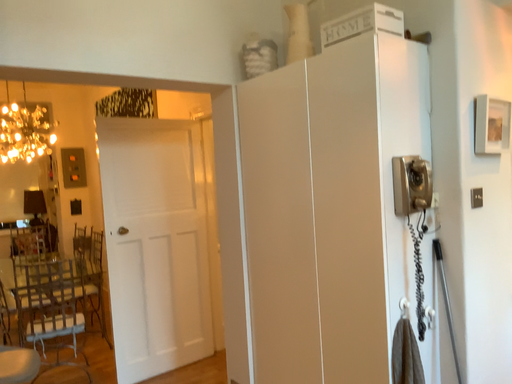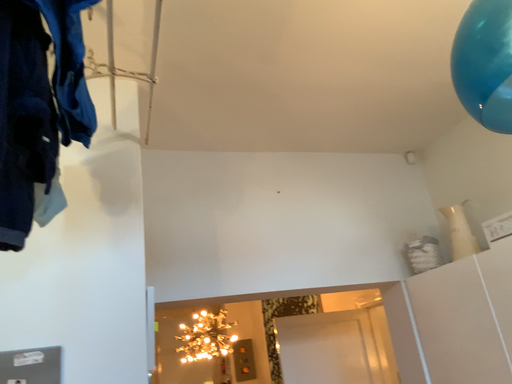
Question: How did the camera likely rotate when shooting the video?

Choices:
 (A) rotated upward
 (B) rotated downward

Answer: (A)